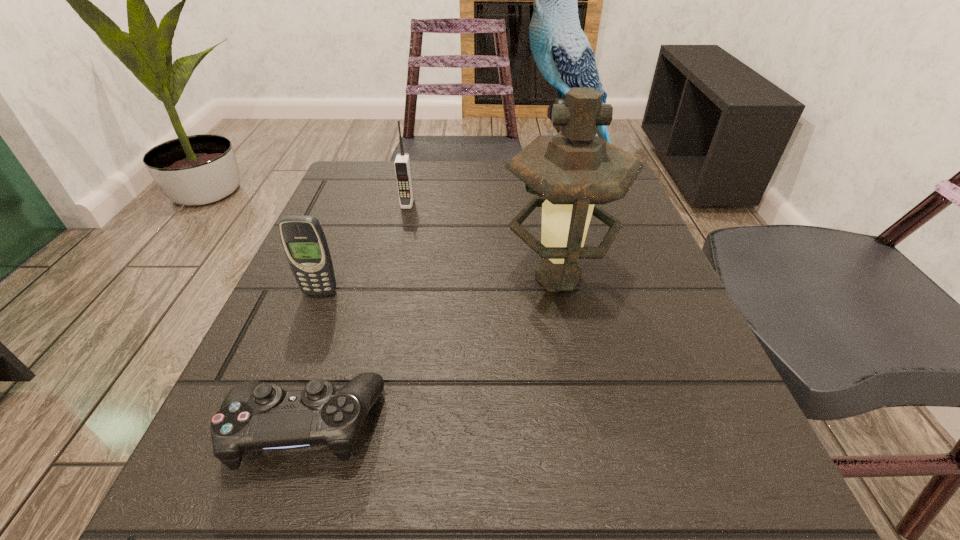
At what (x,y) coordinates should I click in order to perform the action: click on vacant region located on the face of the parakeet. Please return your answer as a coordinate pair (x, y). The image size is (960, 540). Looking at the image, I should click on (392, 182).

This screenshot has width=960, height=540. I want to click on vacant region located on the back of the oil lamp, so click(x=538, y=177).

The width and height of the screenshot is (960, 540). In order to click on free space located 0.160m on the front-facing side of the farther cellular telephone in this screenshot , I will do `click(395, 257)`.

Locate an element on the screen. This screenshot has width=960, height=540. vacant region located 0.270m on the screen of the left cellular telephone is located at coordinates (256, 453).

I want to click on free space located 0.160m on the back of the nearest object, so (346, 300).

Where is `parakeet positioned at the far edge`? Image resolution: width=960 pixels, height=540 pixels. parakeet positioned at the far edge is located at coordinates (561, 50).

Locate an element on the screen. This screenshot has width=960, height=540. cellular telephone present at the far edge is located at coordinates coord(402,165).

Locate an element on the screen. Image resolution: width=960 pixels, height=540 pixels. object present at the near edge is located at coordinates (254, 416).

Find the location of a particular element. Image resolution: width=960 pixels, height=540 pixels. control that is at the left edge is located at coordinates (254, 416).

The width and height of the screenshot is (960, 540). Identify the location of parakeet that is at the right edge. (561, 50).